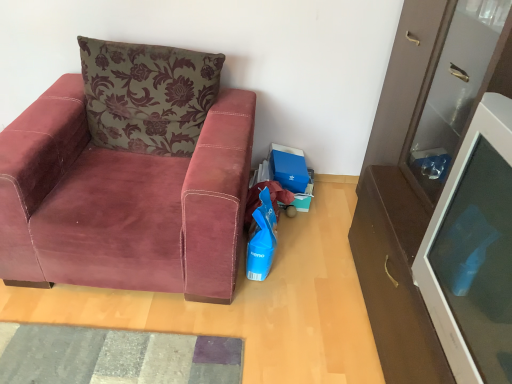
The image size is (512, 384). Find the location of `vacant space in front of velvet maroon armchair at left`. vacant space in front of velvet maroon armchair at left is located at coordinates (124, 334).